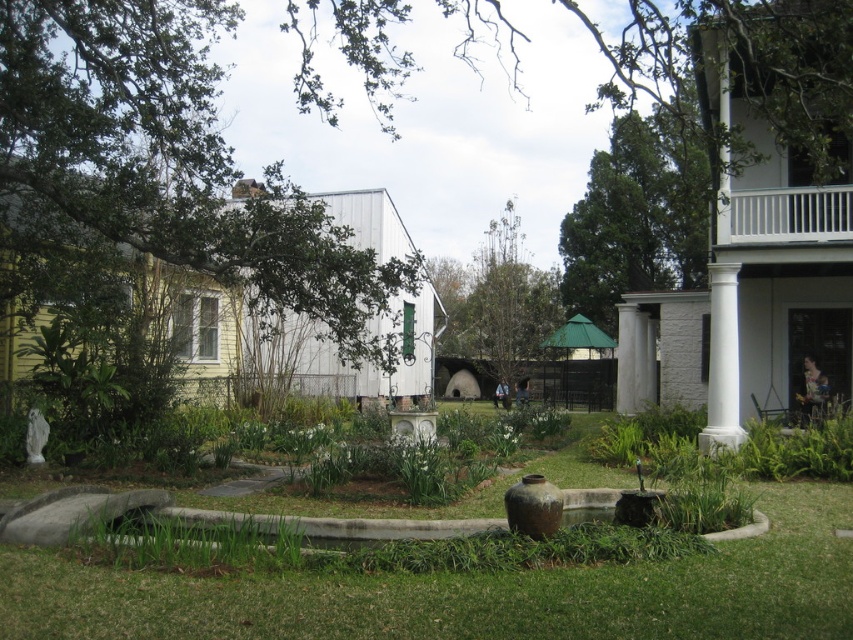
Question: Which object is closer to the camera taking this photo?

Choices:
 (A) white smooth column at right
 (B) white wooden porch at upper right

Answer: (A)

Question: Is white wooden porch at upper right bigger than white smooth column at right?

Choices:
 (A) no
 (B) yes

Answer: (A)

Question: Is white wooden porch at upper right further to camera compared to white smooth column at right?

Choices:
 (A) yes
 (B) no

Answer: (A)

Question: Is white wooden porch at upper right bigger than white smooth column at right?

Choices:
 (A) yes
 (B) no

Answer: (B)